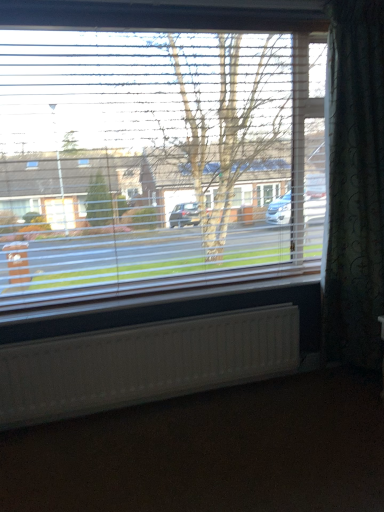
Question: Considering the relative sizes of dark green textured curtain at right and brown matte carpet at lower center in the image provided, is dark green textured curtain at right smaller than brown matte carpet at lower center?

Choices:
 (A) yes
 (B) no

Answer: (B)

Question: From the image's perspective, would you say dark green textured curtain at right is shown under brown matte carpet at lower center?

Choices:
 (A) no
 (B) yes

Answer: (A)

Question: Is dark green textured curtain at right aimed at brown matte carpet at lower center?

Choices:
 (A) no
 (B) yes

Answer: (A)

Question: Is dark green textured curtain at right beside brown matte carpet at lower center?

Choices:
 (A) yes
 (B) no

Answer: (B)

Question: Does dark green textured curtain at right lie in front of brown matte carpet at lower center?

Choices:
 (A) yes
 (B) no

Answer: (B)

Question: From the image's perspective, relative to dark green textured curtain at right, is white textured radiator at lower center above or below?

Choices:
 (A) below
 (B) above

Answer: (A)

Question: Based on their sizes in the image, would you say white textured radiator at lower center is bigger or smaller than dark green textured curtain at right?

Choices:
 (A) small
 (B) big

Answer: (A)

Question: In the image, is white textured radiator at lower center on the left side or the right side of dark green textured curtain at right?

Choices:
 (A) left
 (B) right

Answer: (A)

Question: In terms of height, does white textured radiator at lower center look taller or shorter compared to dark green textured curtain at right?

Choices:
 (A) short
 (B) tall

Answer: (A)

Question: Choose the correct answer: Is transparent plastic blinds at upper center inside dark green textured curtain at right or outside it?

Choices:
 (A) inside
 (B) outside

Answer: (B)

Question: Considering the positions of transparent plastic blinds at upper center and dark green textured curtain at right in the image, is transparent plastic blinds at upper center bigger or smaller than dark green textured curtain at right?

Choices:
 (A) big
 (B) small

Answer: (A)

Question: In the image, is transparent plastic blinds at upper center on the left side or the right side of dark green textured curtain at right?

Choices:
 (A) left
 (B) right

Answer: (A)

Question: From a real-world perspective, is transparent plastic blinds at upper center positioned above or below dark green textured curtain at right?

Choices:
 (A) above
 (B) below

Answer: (A)

Question: From a real-world perspective, is brown matte carpet at lower center physically located above or below white textured radiator at lower center?

Choices:
 (A) above
 (B) below

Answer: (B)

Question: From the image's perspective, is brown matte carpet at lower center positioned above or below white textured radiator at lower center?

Choices:
 (A) below
 (B) above

Answer: (A)